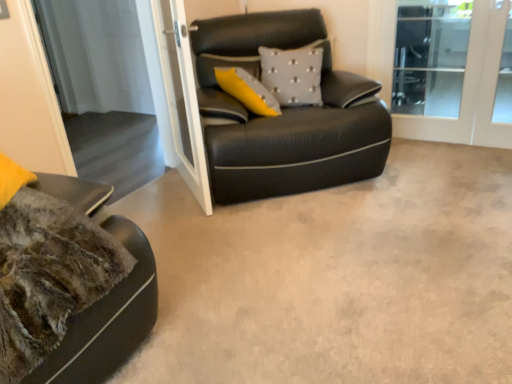
Question: From a real-world perspective, is white glass screen door at upper center, the second screen door viewed from the right, positioned above or below black leather studio couch at center?

Choices:
 (A) below
 (B) above

Answer: (B)

Question: From the image's perspective, relative to black leather studio couch at center, is white glass screen door at upper center, which is the second screen door from left to right, above or below?

Choices:
 (A) above
 (B) below

Answer: (B)

Question: Which of these objects is positioned closest to the black leather studio couch at center?

Choices:
 (A) gray textured pillow at center
 (B) white glass screen door at upper center, which is the second screen door from left to right
 (C) transparent glass screen door at upper center, which is the 3th screen door in right-to-left order
 (D) clear glass screen door at upper right, arranged as the 3th screen door when viewed from the left

Answer: (A)

Question: Based on their relative distances, which object is nearer to the gray textured pillow at center?

Choices:
 (A) transparent glass screen door at upper center, acting as the 1th screen door starting from the left
 (B) white glass screen door at upper center, which is the second screen door from left to right
 (C) clear glass screen door at upper right, arranged as the 3th screen door when viewed from the left
 (D) black leather studio couch at center

Answer: (D)